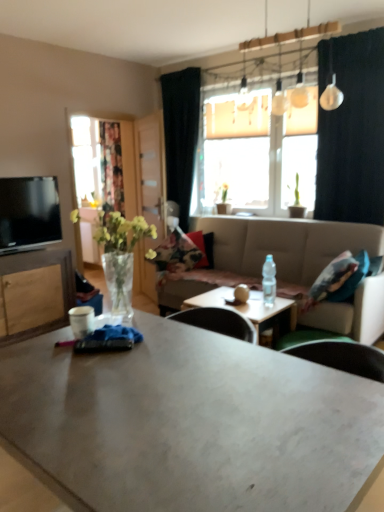
Question: Choose the correct answer: Is matte gray coffee table at center, which appears as the second coffee table when viewed from the back, inside floral fabric curtain at left or outside it?

Choices:
 (A) outside
 (B) inside

Answer: (A)

Question: In the image, is matte gray coffee table at center, which appears as the second coffee table when viewed from the back, positioned in front of or behind floral fabric curtain at left?

Choices:
 (A) behind
 (B) front

Answer: (B)

Question: Which object is the farthest from the floral fabric curtain at left?

Choices:
 (A) beige fabric couch at center
 (B) black fabric curtain at upper right, which is counted as the 1th curtain, starting from the right
 (C) green matte plant at upper center
 (D) transparent glass door at center
 (E) matte gray coffee table at center, which appears as the second coffee table when viewed from the back

Answer: (E)

Question: Which is farther from the floral-patterned fabric pillow at center?

Choices:
 (A) matte black tv at left
 (B) matte white coffee table at center, which appears as the second coffee table when viewed from the front
 (C) black fabric curtain at upper right, the 2th curtain from the back
 (D) clear plastic bottle at center
 (E) black fabric curtain at upper center, the 2th curtain when ordered from right to left

Answer: (C)